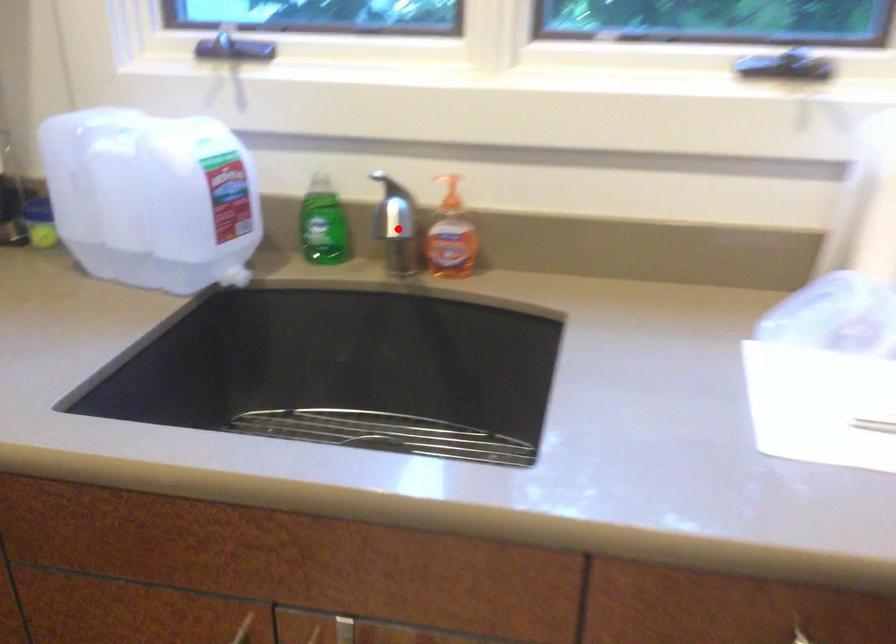
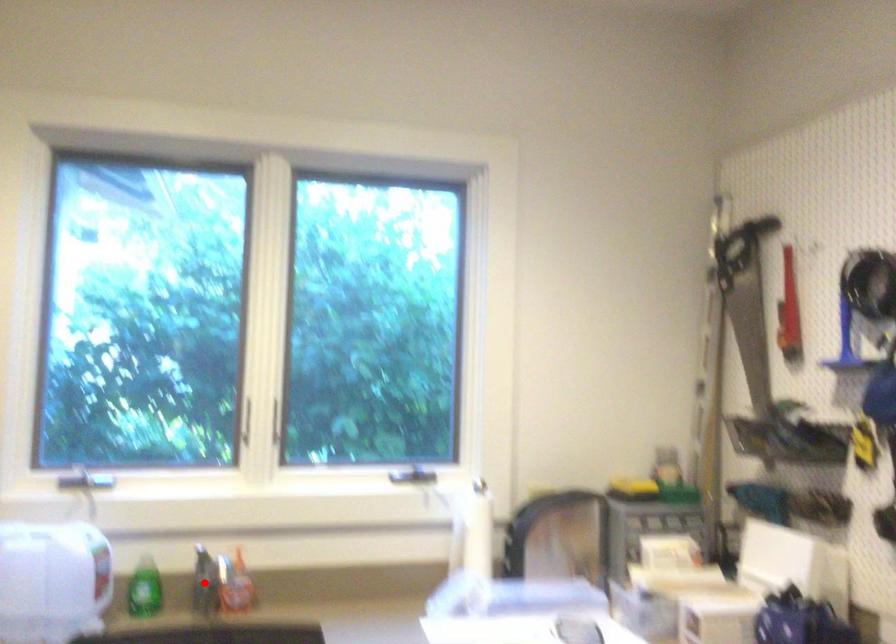
I am providing you with two images of the same scene from different viewpoints. A red point is marked on the first image and another point is marked on the second image. Are the points marked in image1 and image2 representing the same 3D position?

Yes